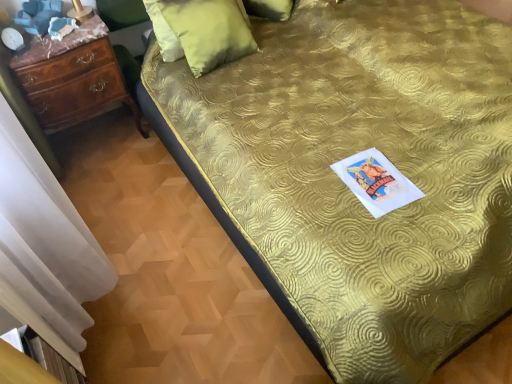
What do you see at coordinates (45, 247) in the screenshot? The height and width of the screenshot is (384, 512). I see `white sheer curtain at left` at bounding box center [45, 247].

What do you see at coordinates (200, 32) in the screenshot? I see `velvet green pillow at upper center, which is the 1th pillow in front-to-back order` at bounding box center [200, 32].

The image size is (512, 384). Describe the element at coordinates (270, 9) in the screenshot. I see `green velvet pillow at upper center, positioned as the 1th pillow in back-to-front order` at that location.

What do you see at coordinates (73, 81) in the screenshot?
I see `mahogany wood chest of drawers at left` at bounding box center [73, 81].

In the scene shown: What is the approximate width of mahogany wood chest of drawers at left?

The width of mahogany wood chest of drawers at left is 11.40 inches.

Find the location of a particular element. The width and height of the screenshot is (512, 384). gold textured bedspread at center is located at coordinates (346, 186).

Consider the image. Is mahogany wood chest of drawers at left oriented towards green velvet pillow at upper center, positioned as the 1th pillow in back-to-front order?

No, mahogany wood chest of drawers at left is not facing towards green velvet pillow at upper center, positioned as the 1th pillow in back-to-front order.

From the image's perspective, is mahogany wood chest of drawers at left under green velvet pillow at upper center, positioned as the 1th pillow in back-to-front order?

Yes, from the image's perspective, mahogany wood chest of drawers at left is below green velvet pillow at upper center, positioned as the 1th pillow in back-to-front order.

From a real-world perspective, is mahogany wood chest of drawers at left above or below green velvet pillow at upper center, the second pillow when ordered from front to back?

Clearly, from a real-world perspective, mahogany wood chest of drawers at left is below green velvet pillow at upper center, the second pillow when ordered from front to back.

From a real-world perspective, starting from the mahogany wood chest of drawers at left, which pillow is the 1st one vertically above it? Please provide its 2D coordinates.

[(270, 9)]

Can you tell me how much green velvet pillow at upper center, positioned as the 1th pillow in back-to-front order, and velvet green pillow at upper center, which is the 1th pillow in front-to-back order, differ in facing direction?

green velvet pillow at upper center, positioned as the 1th pillow in back-to-front order, and velvet green pillow at upper center, which is the 1th pillow in front-to-back order, are facing 36.2 degrees away from each other.

Which of these two, green velvet pillow at upper center, the second pillow when ordered from front to back, or velvet green pillow at upper center, which is counted as the second pillow, starting from the back, stands taller?

Standing taller between the two is velvet green pillow at upper center, which is counted as the second pillow, starting from the back.

Is green velvet pillow at upper center, positioned as the 1th pillow in back-to-front order, next to velvet green pillow at upper center, which is counted as the second pillow, starting from the back?

No.

Is green velvet pillow at upper center, the second pillow when ordered from front to back, bigger or smaller than velvet green pillow at upper center, which is the 1th pillow in front-to-back order?

Clearly, green velvet pillow at upper center, the second pillow when ordered from front to back, is smaller in size than velvet green pillow at upper center, which is the 1th pillow in front-to-back order.

From the picture: Between mahogany wood chest of drawers at left and white sheer curtain at left, which one has more height?

With more height is white sheer curtain at left.

Relative to white sheer curtain at left, is mahogany wood chest of drawers at left in front or behind?

Visually, mahogany wood chest of drawers at left is located behind white sheer curtain at left.

This screenshot has width=512, height=384. Find the location of `chest of drawers above the white sheer curtain at left (from the image's perspective)`. chest of drawers above the white sheer curtain at left (from the image's perspective) is located at coordinates (73, 81).

From the image's perspective, which one is positioned higher, green velvet pillow at upper center, positioned as the 1th pillow in back-to-front order, or white sheer curtain at left?

green velvet pillow at upper center, positioned as the 1th pillow in back-to-front order.

Which object is thinner, green velvet pillow at upper center, positioned as the 1th pillow in back-to-front order, or white sheer curtain at left?

green velvet pillow at upper center, positioned as the 1th pillow in back-to-front order.

Looking at the image, does green velvet pillow at upper center, the second pillow when ordered from front to back, seem bigger or smaller compared to white sheer curtain at left?

Considering their sizes, green velvet pillow at upper center, the second pillow when ordered from front to back, takes up less space than white sheer curtain at left.

Is green velvet pillow at upper center, positioned as the 1th pillow in back-to-front order, next to white sheer curtain at left?

No, green velvet pillow at upper center, positioned as the 1th pillow in back-to-front order, is not with white sheer curtain at left.

From the image's perspective, does gold textured bedspread at center appear higher than green velvet pillow at upper center, the second pillow when ordered from front to back?

No, from the image's perspective, gold textured bedspread at center is not on top of green velvet pillow at upper center, the second pillow when ordered from front to back.

Between gold textured bedspread at center and green velvet pillow at upper center, the second pillow when ordered from front to back, which one has larger size?

Bigger between the two is gold textured bedspread at center.

Is point (373, 17) closer or farther from the camera than point (291, 9)?

Point (373, 17) is positioned closer to the camera compared to point (291, 9).

What's the angular difference between gold textured bedspread at center and green velvet pillow at upper center, positioned as the 1th pillow in back-to-front order,'s facing directions?

gold textured bedspread at center and green velvet pillow at upper center, positioned as the 1th pillow in back-to-front order, are facing 55.3 degrees away from each other.

Would you say gold textured bedspread at center is a long distance from velvet green pillow at upper center, which is counted as the second pillow, starting from the back?

No, there isn't a large distance between gold textured bedspread at center and velvet green pillow at upper center, which is counted as the second pillow, starting from the back.

Is point (489, 79) positioned behind point (181, 43)?

That is False.

Can you confirm if gold textured bedspread at center is shorter than velvet green pillow at upper center, which is the 1th pillow in front-to-back order?

Correct, gold textured bedspread at center is not as tall as velvet green pillow at upper center, which is the 1th pillow in front-to-back order.

In the scene shown: Considering the relative sizes of gold textured bedspread at center and white sheer curtain at left in the image provided, is gold textured bedspread at center taller than white sheer curtain at left?

No, gold textured bedspread at center is not taller than white sheer curtain at left.

Can you confirm if gold textured bedspread at center is positioned to the left of white sheer curtain at left?

Incorrect, gold textured bedspread at center is not on the left side of white sheer curtain at left.

Considering the sizes of objects gold textured bedspread at center and white sheer curtain at left in the image provided, who is smaller, gold textured bedspread at center or white sheer curtain at left?

With smaller size is gold textured bedspread at center.

At what (x,y) coordinates should I click in order to perform the action: click on the chest of drawers located in front of the green velvet pillow at upper center, positioned as the 1th pillow in back-to-front order. Please return your answer as a coordinate pair (x, y). Looking at the image, I should click on (73, 81).

Find the location of `pillow below the green velvet pillow at upper center, positioned as the 1th pillow in back-to-front order (from the image's perspective)`. pillow below the green velvet pillow at upper center, positioned as the 1th pillow in back-to-front order (from the image's perspective) is located at coordinates (200, 32).

From the image, which object appears to be nearer to green velvet pillow at upper center, positioned as the 1th pillow in back-to-front order, velvet green pillow at upper center, which is counted as the second pillow, starting from the back, or gold textured bedspread at center?

Based on the image, velvet green pillow at upper center, which is counted as the second pillow, starting from the back, appears to be nearer to green velvet pillow at upper center, positioned as the 1th pillow in back-to-front order.

Based on their spatial positions, is mahogany wood chest of drawers at left or velvet green pillow at upper center, which is the 1th pillow in front-to-back order, closer to green velvet pillow at upper center, the second pillow when ordered from front to back?

velvet green pillow at upper center, which is the 1th pillow in front-to-back order, is positioned closer to the anchor green velvet pillow at upper center, the second pillow when ordered from front to back.

Considering their positions, is velvet green pillow at upper center, which is the 1th pillow in front-to-back order, positioned further to gold textured bedspread at center than green velvet pillow at upper center, positioned as the 1th pillow in back-to-front order?

The object further to gold textured bedspread at center is green velvet pillow at upper center, positioned as the 1th pillow in back-to-front order.

Based on their spatial positions, is gold textured bedspread at center or green velvet pillow at upper center, the second pillow when ordered from front to back, further from mahogany wood chest of drawers at left?

green velvet pillow at upper center, the second pillow when ordered from front to back, lies further to mahogany wood chest of drawers at left than the other object.

From the image, which object appears to be nearer to green velvet pillow at upper center, positioned as the 1th pillow in back-to-front order, mahogany wood chest of drawers at left or gold textured bedspread at center?

Among the two, gold textured bedspread at center is located nearer to green velvet pillow at upper center, positioned as the 1th pillow in back-to-front order.

Considering their positions, is velvet green pillow at upper center, which is the 1th pillow in front-to-back order, positioned further to gold textured bedspread at center than white sheer curtain at left?

Among the two, white sheer curtain at left is located further to gold textured bedspread at center.

Based on their spatial positions, is green velvet pillow at upper center, positioned as the 1th pillow in back-to-front order, or velvet green pillow at upper center, which is the 1th pillow in front-to-back order, further from mahogany wood chest of drawers at left?

green velvet pillow at upper center, positioned as the 1th pillow in back-to-front order, is positioned further to the anchor mahogany wood chest of drawers at left.

Looking at the image, which one is located closer to velvet green pillow at upper center, which is counted as the second pillow, starting from the back, mahogany wood chest of drawers at left or gold textured bedspread at center?

mahogany wood chest of drawers at left is closer to velvet green pillow at upper center, which is counted as the second pillow, starting from the back.

In order to click on pillow between mahogany wood chest of drawers at left and green velvet pillow at upper center, positioned as the 1th pillow in back-to-front order in this screenshot , I will do click(x=200, y=32).

Locate an element on the screen. chest of drawers between white sheer curtain at left and green velvet pillow at upper center, positioned as the 1th pillow in back-to-front order, in the front-back direction is located at coordinates (73, 81).

Locate an element on the screen. chest of drawers between white sheer curtain at left and velvet green pillow at upper center, which is counted as the second pillow, starting from the back, along the z-axis is located at coordinates (73, 81).

Locate an element on the screen. Image resolution: width=512 pixels, height=384 pixels. pillow positioned between white sheer curtain at left and green velvet pillow at upper center, positioned as the 1th pillow in back-to-front order, from near to far is located at coordinates (200, 32).